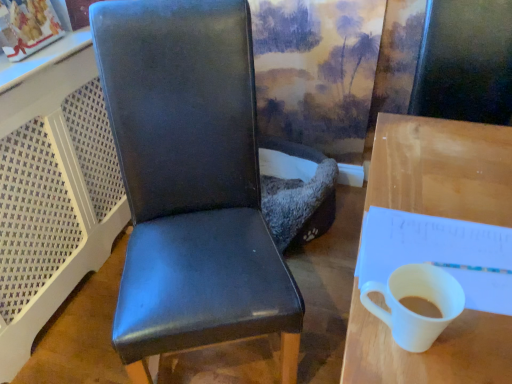
Image resolution: width=512 pixels, height=384 pixels. Find the location of `free space between white paper notepad at right and white glossy mug at right`. free space between white paper notepad at right and white glossy mug at right is located at coordinates (471, 334).